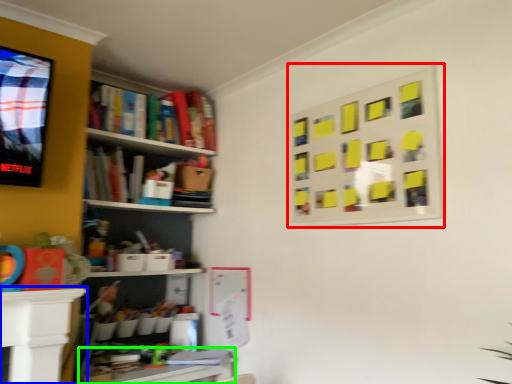
Question: Which object is the closest to the bulletin board (highlighted by a red box)? Choose among these: table (highlighted by a blue box) or table (highlighted by a green box).

Choices:
 (A) table
 (B) table

Answer: (B)